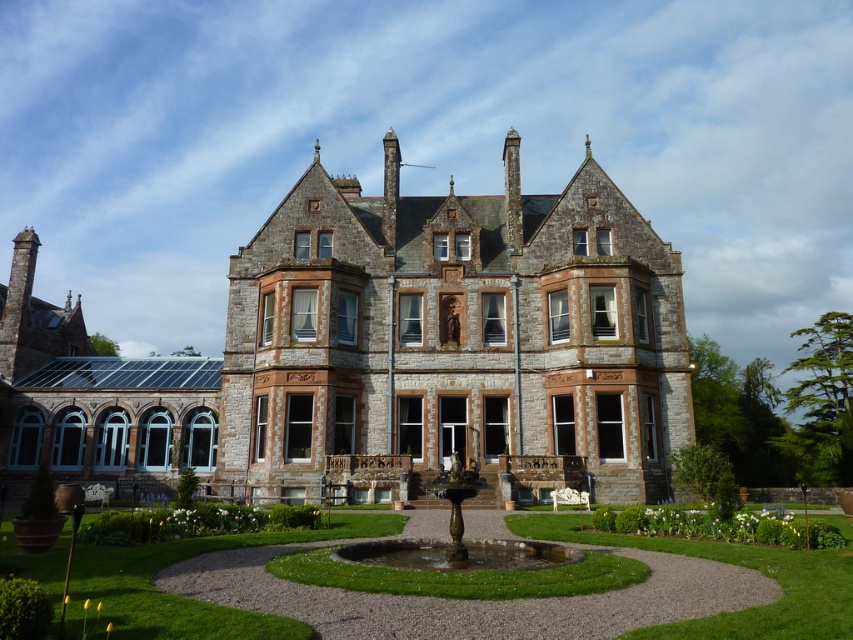
You are standing at the entrance of the stone mansion at center and want to walk towards the green grass at center. Which direction should you go?

Since the stone mansion at center is to the left of green grass at center, you should walk to the right to reach the green grass at center.

You are a landscape architect planning to install a new garden feature between the stone mansion at center and the green grass at center. Based on their widths, which area should you prioritize for the feature to ensure it is proportionally balanced with the mansion?

The stone mansion at center is wider than the green grass at center. To maintain proportional balance, the garden feature should be placed closer to the stone mansion at center since its width is greater, allowing the feature to align better with the mansion.